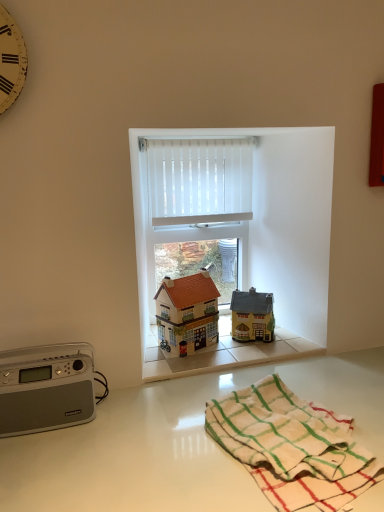
The height and width of the screenshot is (512, 384). What are the coordinates of `free space in front of matte brown house at center, which ranks as the 1th toy in left-to-right order` in the screenshot? It's located at (185, 364).